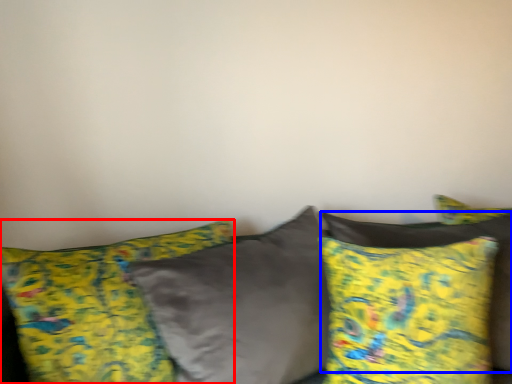
Question: Which point is further to the camera, pillow (highlighted by a red box) or pillow (highlighted by a blue box)?

Choices:
 (A) pillow
 (B) pillow

Answer: (B)